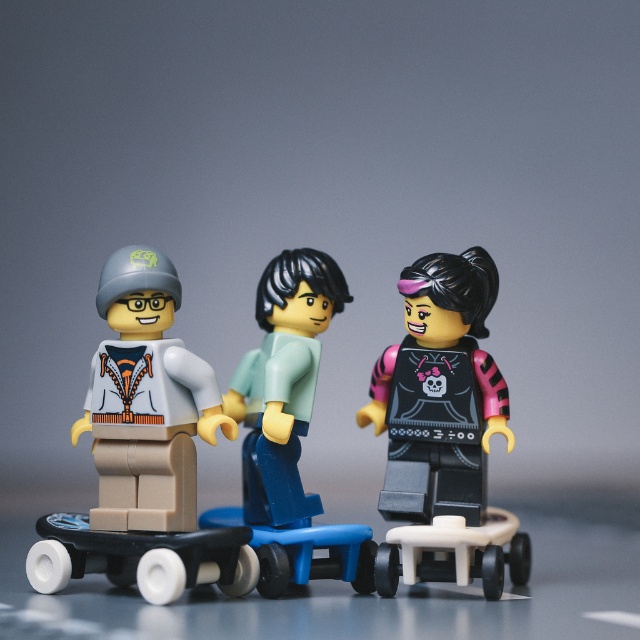
You are a photographer trying to capture the matte white jacket at center in the image. Based on its position coordinates, where should you aim your camera?

The matte white jacket at center is located at coordinates point (154,448), so aim your camera there to capture it.

You are a photographer setting up a shoot with the three LEGO minifigures on skateboards. You need to ensure that the matte white jacket at center and the white plastic skateboard at lower right are visible in the frame. Based on their sizes, which object should you focus on first to make sure it fits within the camera frame?

The matte white jacket at center is taller than the white plastic skateboard at lower right, so you should focus on ensuring the matte white jacket at center fits first since it is larger.